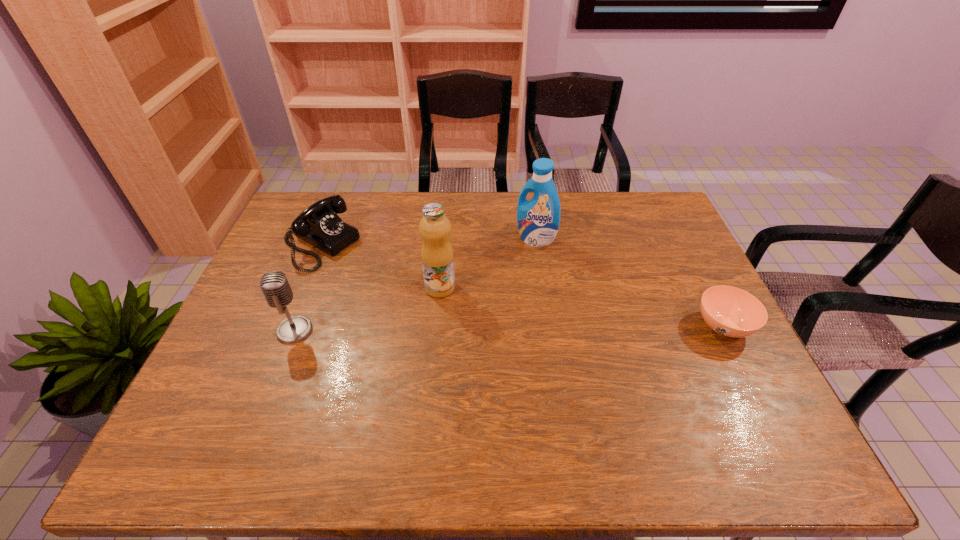
What are the coordinates of `vacant space on the desktop that is between the microphone and the rightmost object and is positioned on the front label of the third object from right to left` in the screenshot? It's located at (533, 328).

This screenshot has height=540, width=960. I want to click on vacant space on the desktop that is between the third tallest object and the shortest object and is positioned on the front-facing side of the fourth object from left to right, so click(449, 329).

Identify the location of free spot on the desktop that is between the microphone and the soup bowl and is positioned on the dial of the second shortest object. (470, 329).